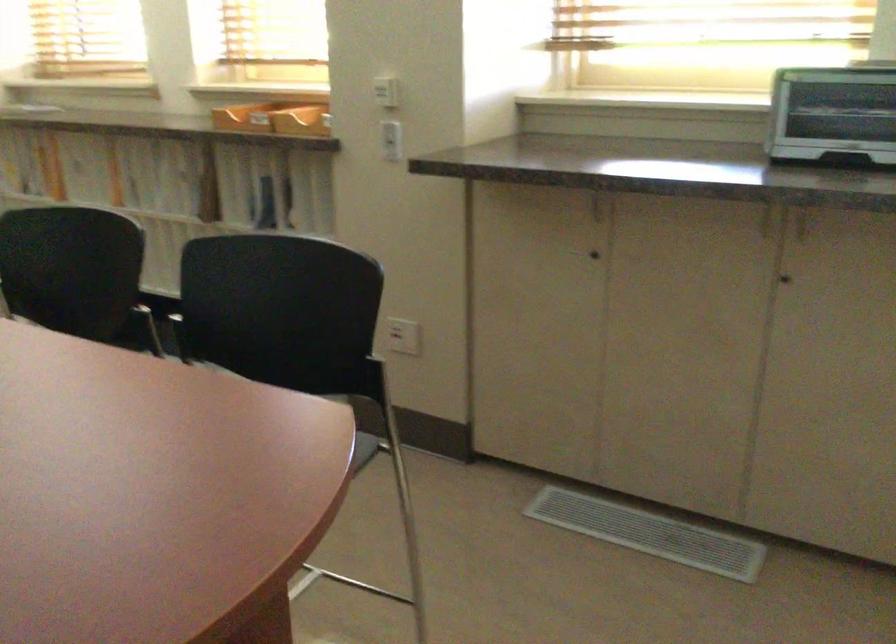
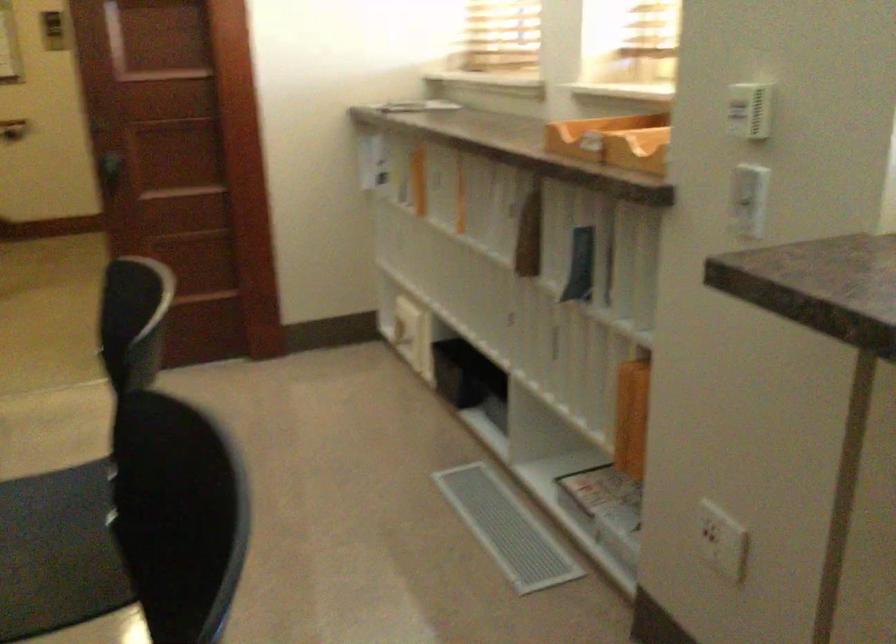
Locate, in the second image, the point that corresponds to point 279,111 in the first image.

(614, 140)